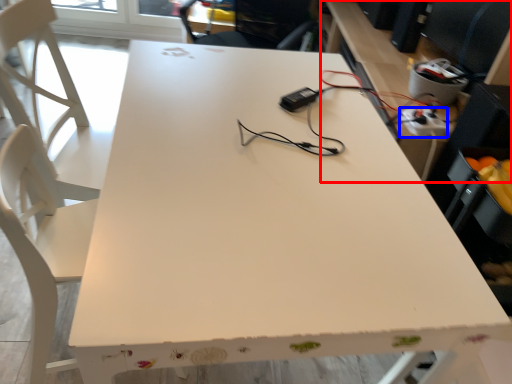
Question: Which point is further to the camera, computer desk (highlighted by a red box) or extension cord (highlighted by a blue box)?

Choices:
 (A) computer desk
 (B) extension cord

Answer: (B)